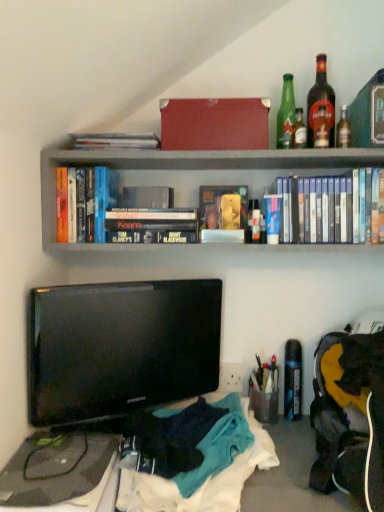
Question: From a real-world perspective, is black matte dvd case at upper center, which is counted as the 1th book, starting from the right, physically below dark amber glass bottle at upper right, which is the third bottle from left to right?

Choices:
 (A) yes
 (B) no

Answer: (A)

Question: Is black matte dvd case at upper center, which is counted as the 1th book, starting from the right, at the left side of dark amber glass bottle at upper right, which appears as the 2th bottle when viewed from the right?

Choices:
 (A) yes
 (B) no

Answer: (A)

Question: Is dark amber glass bottle at upper right, which appears as the 2th bottle when viewed from the right, a part of black matte dvd case at upper center, which is counted as the 1th book, starting from the right?

Choices:
 (A) no
 (B) yes

Answer: (A)

Question: Is black matte dvd case at upper center, marked as the third book in a left-to-right arrangement, not within dark amber glass bottle at upper right, which appears as the 2th bottle when viewed from the right?

Choices:
 (A) no
 (B) yes

Answer: (B)

Question: Does black matte dvd case at upper center, marked as the third book in a left-to-right arrangement, come behind dark amber glass bottle at upper right, which is the third bottle from left to right?

Choices:
 (A) no
 (B) yes

Answer: (A)

Question: Can you confirm if black matte dvd case at upper center, which is counted as the 1th book, starting from the right, is positioned to the right of dark amber glass bottle at upper right, which appears as the 2th bottle when viewed from the right?

Choices:
 (A) yes
 (B) no

Answer: (B)

Question: Is hardcover book at upper right, which ranks as the fourth paperback book in left-to-right order, positioned in front of green glass bottle at upper right, which appears as the 4th bottle when viewed from the left?

Choices:
 (A) no
 (B) yes

Answer: (B)

Question: Is hardcover book at upper right, the 1th paperback book viewed from the right, surrounding green glass bottle at upper right, which appears as the 4th bottle when viewed from the left?

Choices:
 (A) yes
 (B) no

Answer: (B)

Question: Is hardcover book at upper right, which ranks as the fourth paperback book in left-to-right order, directly adjacent to green glass bottle at upper right, which appears as the 4th bottle when viewed from the left?

Choices:
 (A) yes
 (B) no

Answer: (A)

Question: Does hardcover book at upper right, which ranks as the fourth paperback book in left-to-right order, have a smaller size compared to green glass bottle at upper right, placed as the 1th bottle when sorted from right to left?

Choices:
 (A) yes
 (B) no

Answer: (B)

Question: Is hardcover book at upper right, the 1th paperback book viewed from the right, outside green glass bottle at upper right, placed as the 1th bottle when sorted from right to left?

Choices:
 (A) yes
 (B) no

Answer: (A)

Question: From a real-world perspective, is hardcover book at upper right, the 1th paperback book viewed from the right, positioned over green glass bottle at upper right, which appears as the 4th bottle when viewed from the left, based on gravity?

Choices:
 (A) no
 (B) yes

Answer: (B)

Question: Is matte red box at upper center thinner than blue matte book at center, which appears as the third paperback book when viewed from the left?

Choices:
 (A) no
 (B) yes

Answer: (A)